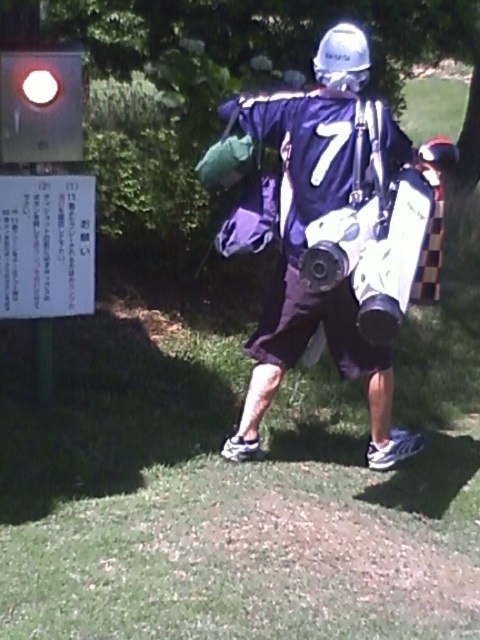
You are a photographer trying to capture the best angle of the futuristic costume. You notice two points marked in the image. Which point, point 1 at coordinates [332,157] or point 2 at coordinates [85,262], is closer to your camera lens?

Point 1 at coordinates [332,157] is closer to the camera lens than point 2 at coordinates [85,262].

You are a photographer trying to capture a clear shot of the purple matte jersey at center and the matte glass traffic light at upper left. Which object should you focus on first to ensure both are in focus without adjusting the camera settings?

The purple matte jersey at center is in front of the matte glass traffic light at upper left. To keep both in focus, focus on the purple matte jersey at center first since it is closer to the camera.

You are a photographer trying to capture the purple matte jersey at center and the white paper sign at left in a single frame. Based on their positions, which object should you focus on first to ensure both are in the shot?

The white paper sign at left should be focused on first since the purple matte jersey at center is to the right of it, allowing the photographer to frame both by starting with the leftmost object.